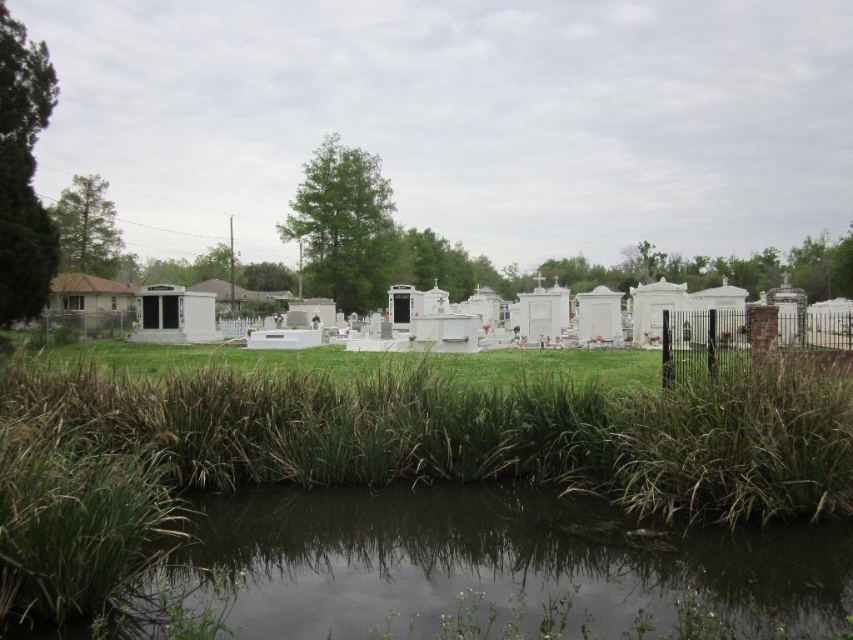
You are a maintenance worker needing to cross from the green grass at lower center to the green grassy water at lower center. Your equipment has a maximum reach of 4 meters. Can you safely make the jump without needing to extend it further?

The distance between the green grass at lower center and the green grassy water at lower center is 4.57 meters, which exceeds your equipment reach of 4 meters. You cannot safely jump without extending it further.

You are a gardener tasked with trimming the green grassy water at lower center and the black wrought iron fence at right. Which object requires less height adjustment to reach its top?

The green grassy water at lower center is not as tall as the black wrought iron fence at right, so the green grassy water at lower center requires less height adjustment to reach its top.